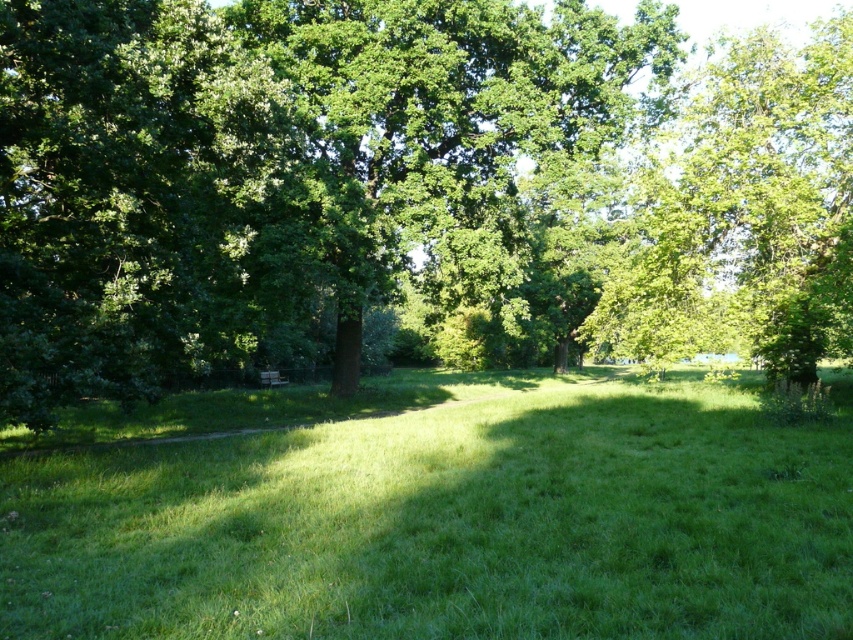
You are standing at the entrance of the park and want to find the green leafy tree at center. According to the coordinates provided, where should you look to locate it?

The green leafy tree at center is located at point 0.298 along the horizontal axis and 0.478 along the vertical axis, so you should look towards the lower left area of the scene since lower values on the horizontal axis mean left and lower values on the vertical axis mean lower positions.

You are a park visitor who wants to take a photo of the green leafy tree at center and the green grassy field at center together in the same frame. Your camera has a maximum focus range of 12 meters. Can you capture both objects in focus without moving your position?

The distance between the green leafy tree at center and the green grassy field at center is 11.56 meters, which is within the camera focus range of 12 meters. Therefore, you can capture both objects in focus without moving.